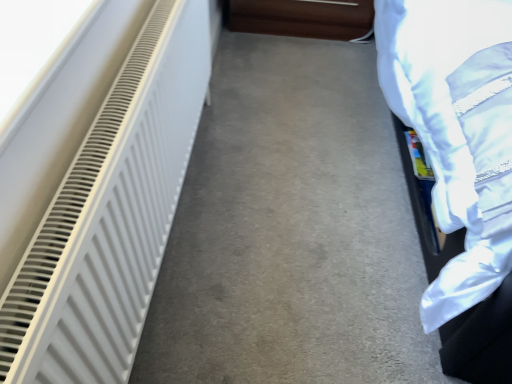
What are the coordinates of `free point above white matte radiator at left (from a real-world perspective)` in the screenshot? It's located at (125, 85).